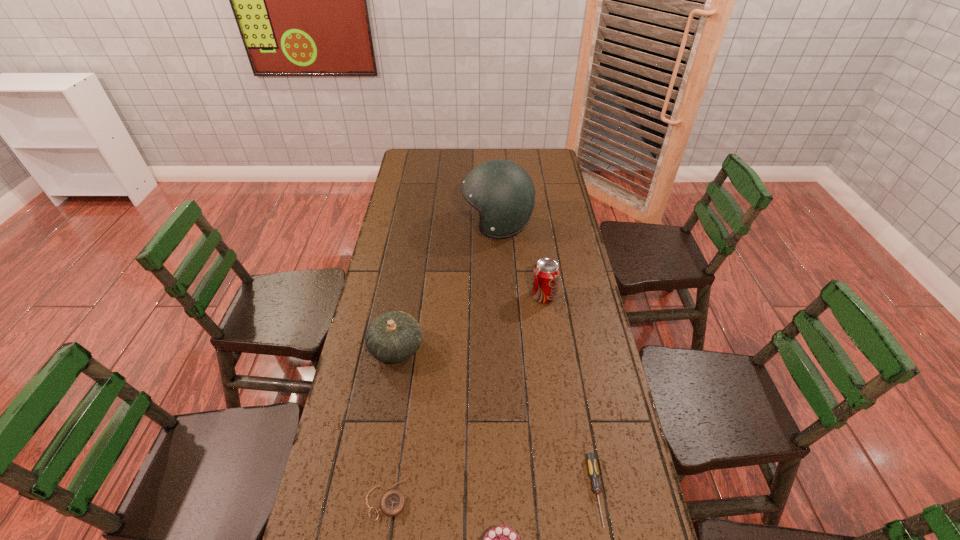
Identify the location of the farthest object. Image resolution: width=960 pixels, height=540 pixels. (502, 191).

Where is `football helmet`? The width and height of the screenshot is (960, 540). football helmet is located at coordinates (502, 191).

The image size is (960, 540). What are the coordinates of `soda can` in the screenshot? It's located at (546, 273).

You are a GUI agent. You are given a task and a screenshot of the screen. Output one action in this format:
    pyautogui.click(x=<x>, y=<y>)
    Task: Click on the gourd
    
    Given the screenshot: What is the action you would take?
    pyautogui.click(x=394, y=336)

This screenshot has height=540, width=960. I want to click on the fifth tallest object, so click(x=591, y=457).

Find the location of a particular element. Image resolution: width=960 pixels, height=540 pixels. screwdriver is located at coordinates (591, 457).

You are a GUI agent. You are given a task and a screenshot of the screen. Output one action in this format:
    pyautogui.click(x=<x>, y=<y>)
    Task: Click on the pocket watch
    
    Given the screenshot: What is the action you would take?
    pyautogui.click(x=392, y=503)

Identify the location of vacant space located 0.320m at the face opening of the football helmet. (386, 225).

You are a GUI agent. You are given a task and a screenshot of the screen. Output one action in this format:
    pyautogui.click(x=<x>, y=<y>)
    Task: Click on the vacant space located at the face opening of the football helmet
    Image resolution: width=960 pixels, height=540 pixels.
    Given the screenshot: What is the action you would take?
    pyautogui.click(x=450, y=225)

Where is `free space located at the face opening of the football helmet`? The width and height of the screenshot is (960, 540). free space located at the face opening of the football helmet is located at coordinates (433, 225).